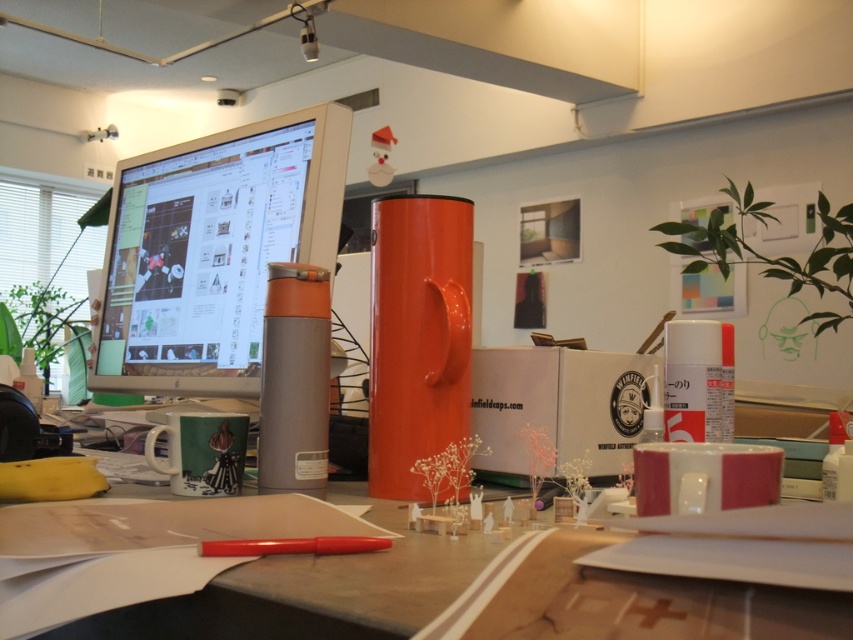
You are organizing your desk and want to place a new keyboard between the satin silver monitor at upper left and the matte plastic desk at center. Is there enough space between them to fit the keyboard?

The satin silver monitor at upper left is to the left of the matte plastic desk at center, so there is space between them to place the keyboard.

In the scene shown: You are setting up a new monitor and need to ensure it fits on your desk. The satin silver monitor at upper left is the new one. Can you determine if it will fit vertically on the matte plastic desk at center based on their heights?

The satin silver monitor at upper left is taller than the matte plastic desk at center, so it will not fit vertically since the monitor is taller than the desk.

What are the coordinates of the satin silver monitor at upper left?

The coordinates of the satin silver monitor at upper left are at point (210, 250).